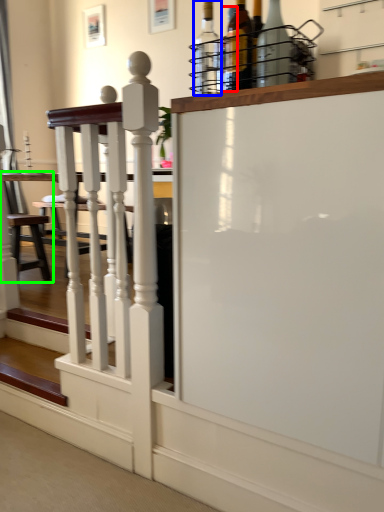
Question: Which object is positioned closest to bottle (highlighted by a red box)? Select from bottle (highlighted by a blue box) and armchair (highlighted by a green box).

Choices:
 (A) bottle
 (B) armchair

Answer: (A)